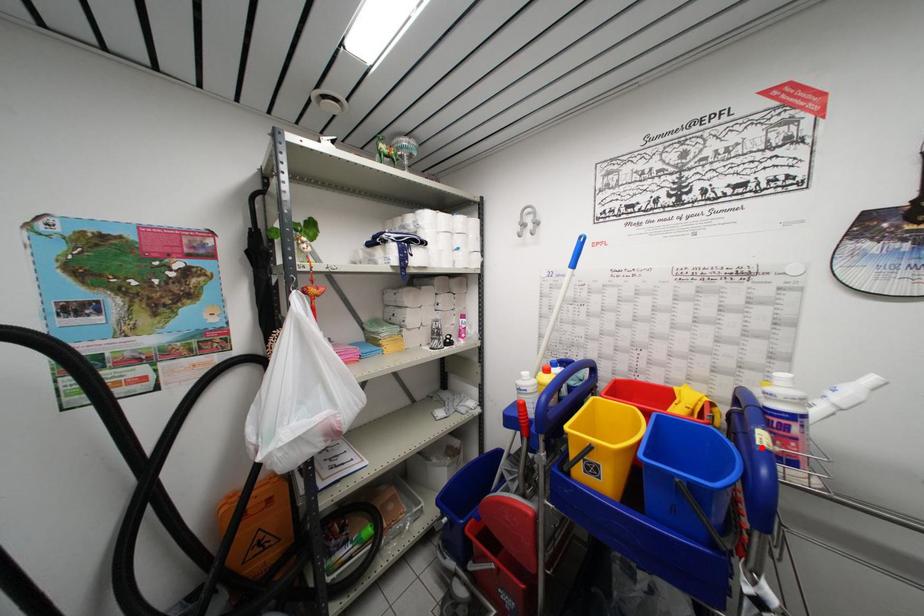
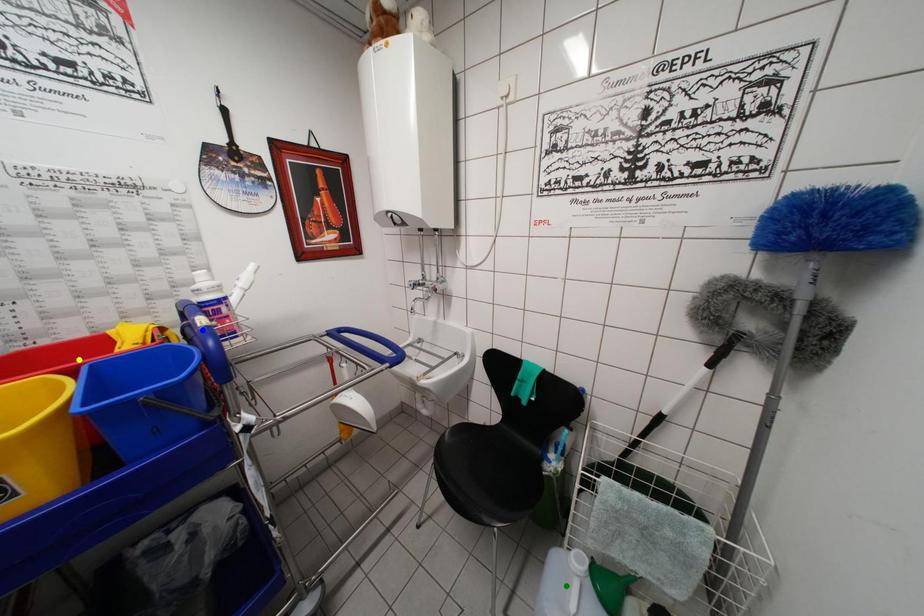
Question: I am providing you with two images of the same scene from different viewpoints. A red point is marked on the first image. You are given multiple points on the second image. Which point in image 2 is actually the same real-world point as the red point in image 1?

Choices:
 (A) yellow point
 (B) blue point
 (C) green point

Answer: (B)